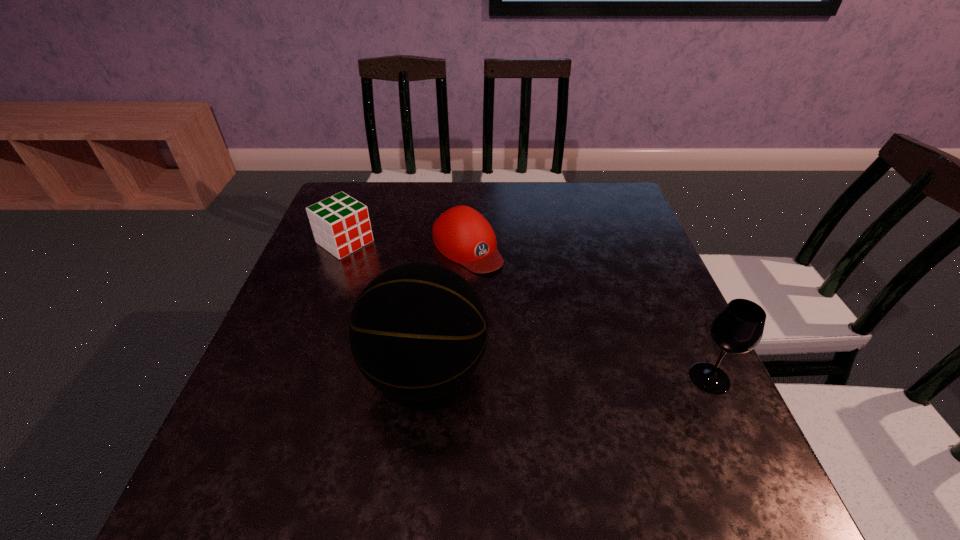
Identify which object is located as the nearest to the third shortest object. Please provide its 2D coordinates. Your answer should be formatted as a tuple, i.e. [(x, y)], where the tuple contains the x and y coordinates of a point satisfying the conditions above.

[(417, 332)]

Find the location of `vacant area that satisfies the following two spatial constraints: 1. on the front side of the rightmost object; 2. on the left side of the baseball cap`. vacant area that satisfies the following two spatial constraints: 1. on the front side of the rightmost object; 2. on the left side of the baseball cap is located at coordinates (463, 378).

Identify the location of free spot that satisfies the following two spatial constraints: 1. on the front side of the leftmost object; 2. on the right side of the third shortest object. The width and height of the screenshot is (960, 540). coord(295,378).